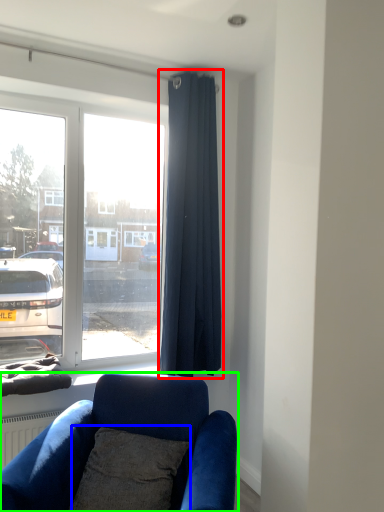
Question: Which is farther away from curtain (highlighted by a red box)? pillow (highlighted by a blue box) or studio couch (highlighted by a green box)?

Choices:
 (A) pillow
 (B) studio couch

Answer: (A)